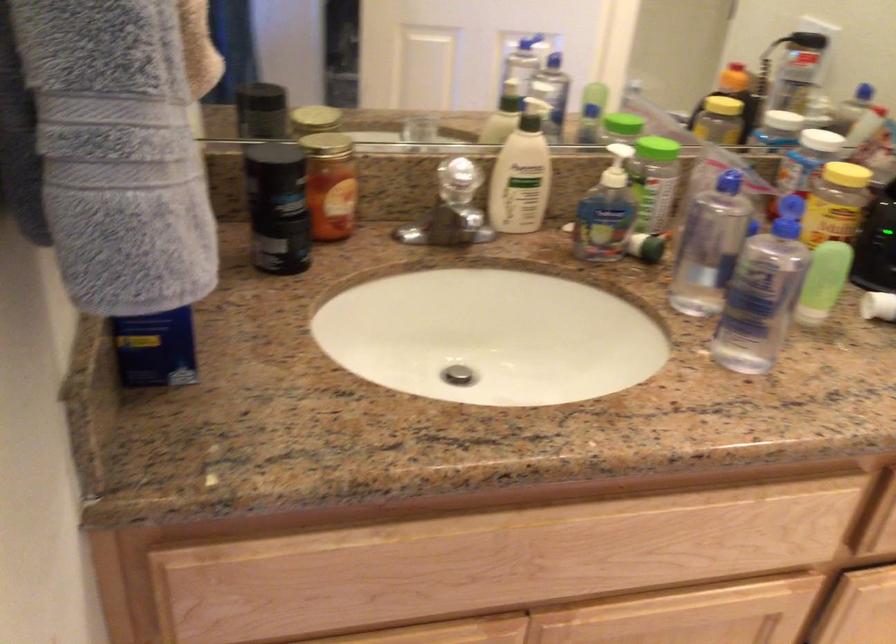
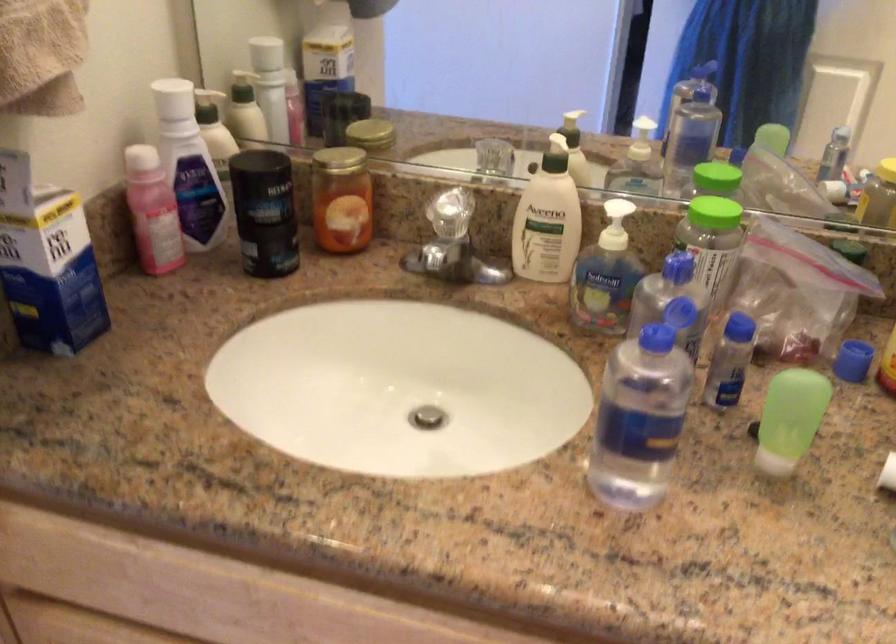
Question: The camera is either moving clockwise (left) or counter-clockwise (right) around the object. The first image is from the beginning of the video and the second image is from the end. Is the camera moving left or right when shooting the video?

Choices:
 (A) Left
 (B) Right

Answer: (B)